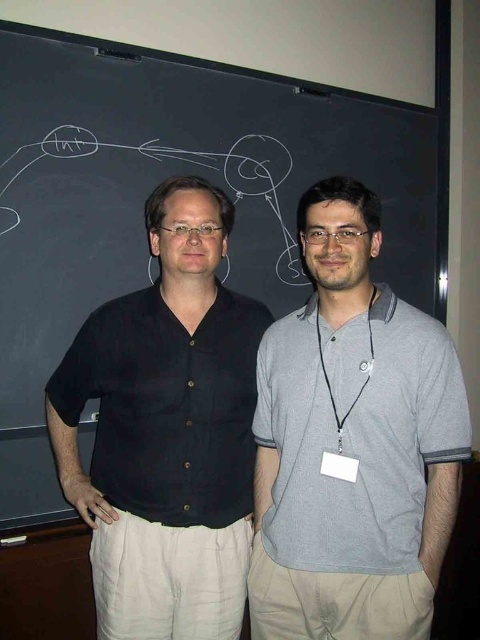
How far apart are gray cotton polo shirt at center and black cotton shirt at left?

The distance of gray cotton polo shirt at center from black cotton shirt at left is 9.65 inches.

Can you confirm if gray cotton polo shirt at center is positioned above black cotton shirt at left?

Actually, gray cotton polo shirt at center is below black cotton shirt at left.

Between point (292, 531) and point (192, 461), which one is positioned behind?

Positioned behind is point (192, 461).

You are a GUI agent. You are given a task and a screenshot of the screen. Output one action in this format:
    pyautogui.click(x=<x>, y=<y>)
    Task: Click on the gray cotton polo shirt at center
    This screenshot has height=640, width=480.
    Given the screenshot: What is the action you would take?
    pyautogui.click(x=352, y=444)